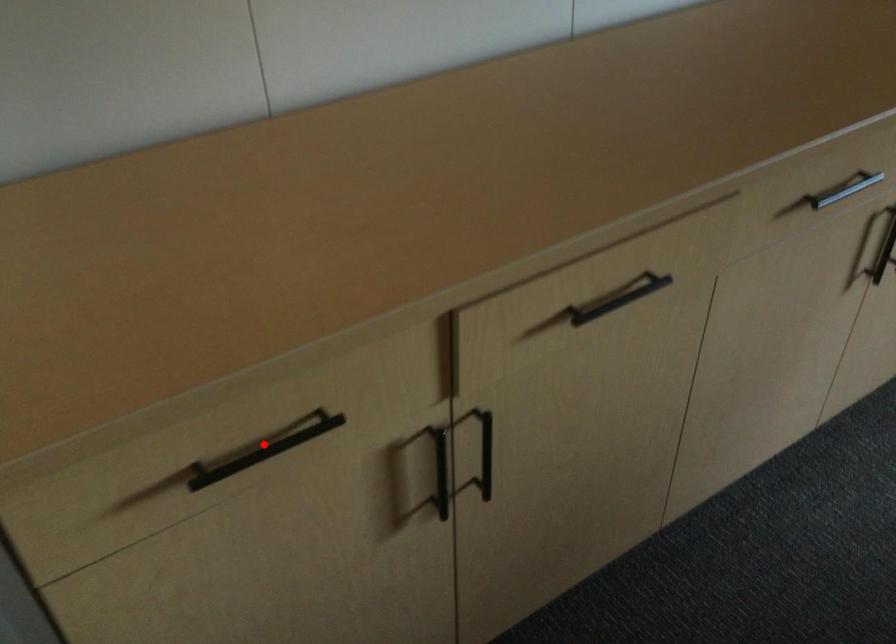
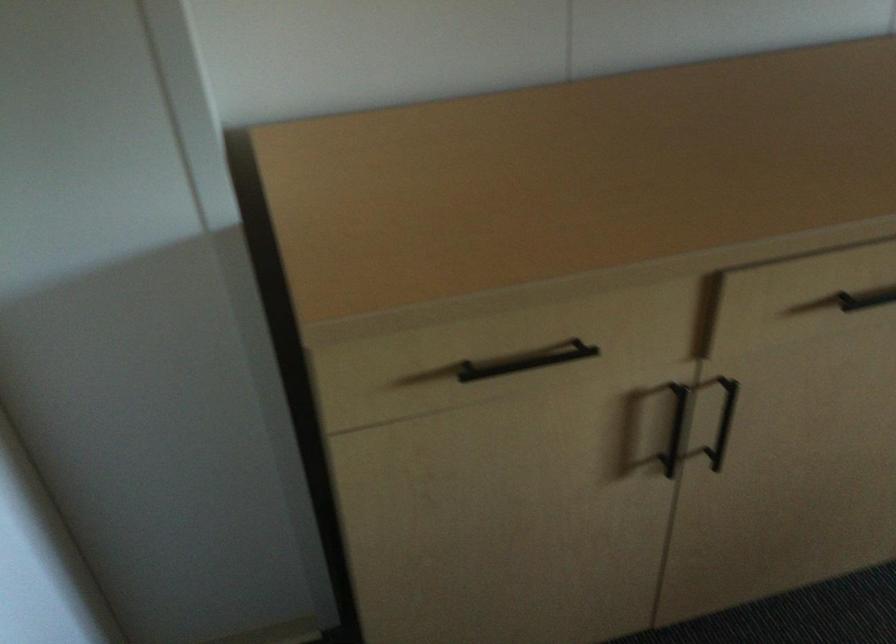
Locate, in the second image, the point that corresponds to the highlighted location in the first image.

(526, 361)